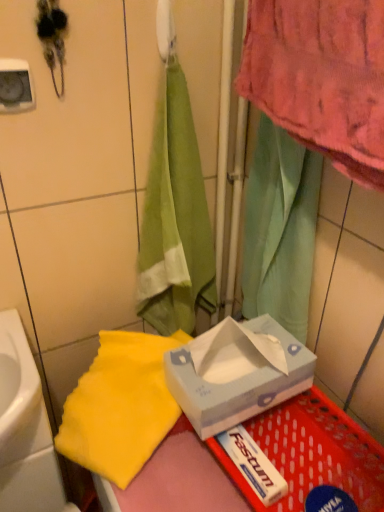
Question: Are white glossy sink at lower left and white paper tissue box at center located far from each other?

Choices:
 (A) no
 (B) yes

Answer: (A)

Question: From a real-world perspective, is white glossy sink at lower left on white paper tissue box at center?

Choices:
 (A) yes
 (B) no

Answer: (B)

Question: Is white glossy sink at lower left outside of white paper tissue box at center?

Choices:
 (A) no
 (B) yes

Answer: (B)

Question: Considering the relative positions of white glossy sink at lower left and white paper tissue box at center in the image provided, is white glossy sink at lower left to the right of white paper tissue box at center from the viewer's perspective?

Choices:
 (A) no
 (B) yes

Answer: (A)

Question: Is white glossy sink at lower left behind white paper tissue box at center?

Choices:
 (A) yes
 (B) no

Answer: (A)

Question: From a real-world perspective, relative to white glossy sink at lower left, is white plastic basket at lower right vertically above or below?

Choices:
 (A) below
 (B) above

Answer: (B)

Question: Is point (317, 392) positioned closer to the camera than point (36, 369)?

Choices:
 (A) closer
 (B) farther

Answer: (A)

Question: Is white plastic basket at lower right taller or shorter than white glossy sink at lower left?

Choices:
 (A) tall
 (B) short

Answer: (B)

Question: In terms of width, does white plastic basket at lower right look wider or thinner when compared to white glossy sink at lower left?

Choices:
 (A) wide
 (B) thin

Answer: (A)

Question: Is point (112, 390) positioned closer to the camera than point (360, 472)?

Choices:
 (A) farther
 (B) closer

Answer: (A)

Question: Is yellow fabric towel at lower left in front of or behind white plastic basket at lower right in the image?

Choices:
 (A) front
 (B) behind

Answer: (B)

Question: Choose the correct answer: Is yellow fabric towel at lower left inside white plastic basket at lower right or outside it?

Choices:
 (A) outside
 (B) inside

Answer: (A)

Question: In terms of size, does yellow fabric towel at lower left appear bigger or smaller than white plastic basket at lower right?

Choices:
 (A) small
 (B) big

Answer: (B)

Question: Looking at their shapes, would you say yellow fabric towel at lower left is wider or thinner than white glossy sink at lower left?

Choices:
 (A) thin
 (B) wide

Answer: (B)

Question: From a real-world perspective, is yellow fabric towel at lower left physically located above or below white glossy sink at lower left?

Choices:
 (A) below
 (B) above

Answer: (B)